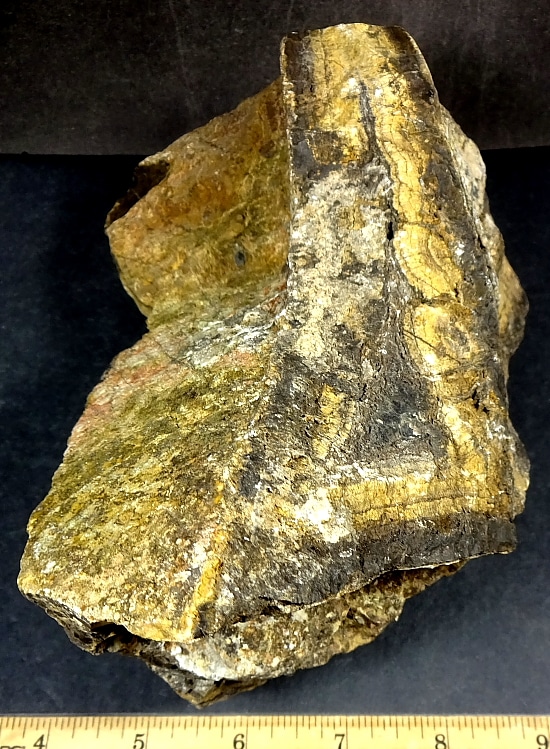
Where is `black wall`? This screenshot has height=749, width=550. black wall is located at coordinates (154, 67).